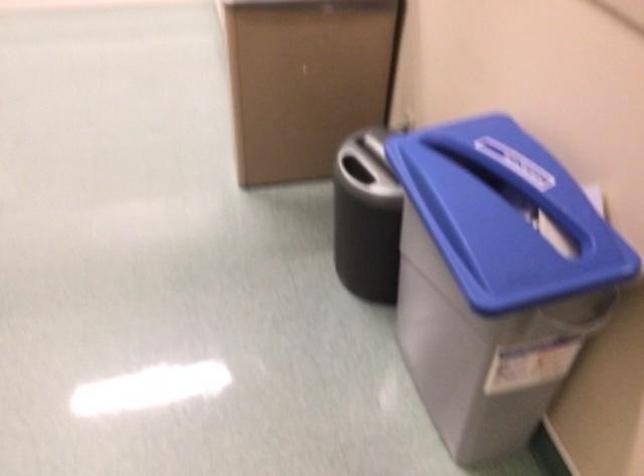
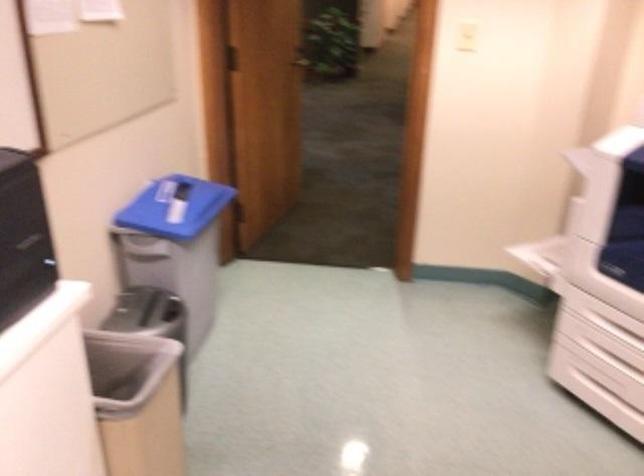
Locate, in the second image, the point that corresponds to pixel 368 170 in the first image.

(154, 308)